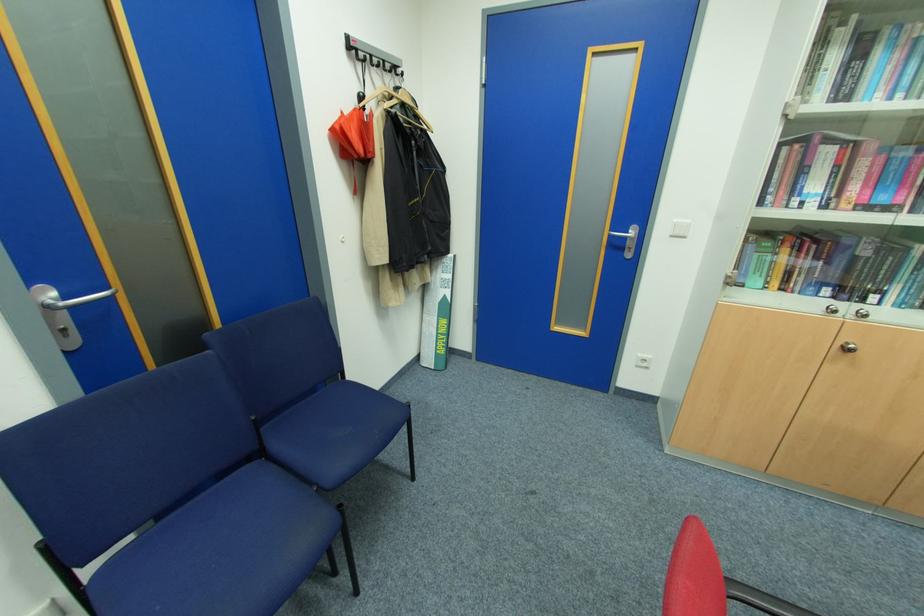
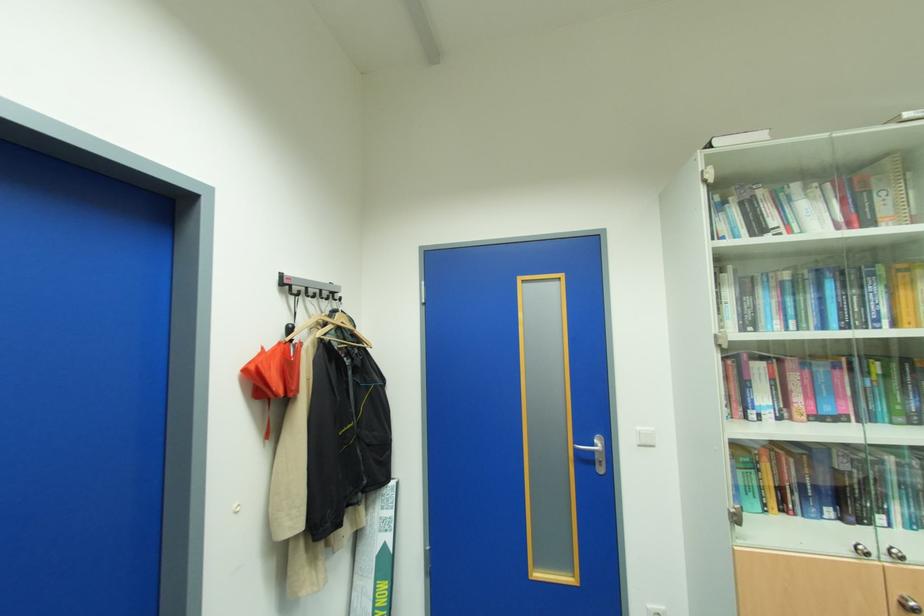
Question: Based on the continuous images, in which direction is the camera rotating? Reply with the corresponding letter.

Choices:
 (A) Left
 (B) Right
 (C) Up
 (D) Down

Answer: (C)